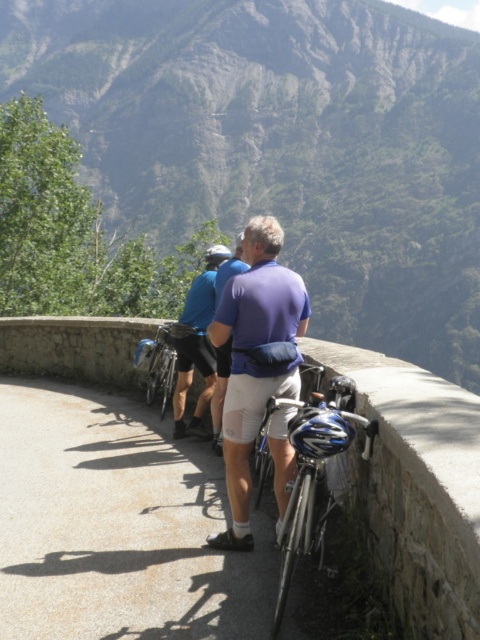
Question: Which point is closer to the camera?

Choices:
 (A) shiny metallic bicycle at lower right
 (B) silver metallic bicycle at center
 (C) matte blue helmet at center

Answer: (A)

Question: Based on their relative distances, which object is nearer to the silver metallic bicycle at center?

Choices:
 (A) blue fabric shirt at center
 (B) matte blue helmet at center

Answer: (A)

Question: Which point is farther to the camera?

Choices:
 (A) purple matte shirt at center
 (B) metallic silver bicycle at center
 (C) shiny metallic bicycle at lower right
 (D) silver metallic bicycle at center

Answer: (D)

Question: Does metallic silver bicycle at center appear under blue fabric shirt at center?

Choices:
 (A) no
 (B) yes

Answer: (B)

Question: Is shiny metallic bicycle at lower right above matte blue helmet at center?

Choices:
 (A) no
 (B) yes

Answer: (A)

Question: Does blue fabric shirt at center have a smaller size compared to matte blue helmet at center?

Choices:
 (A) no
 (B) yes

Answer: (B)